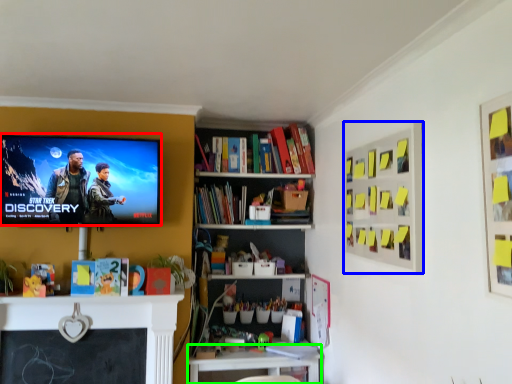
Question: Which object is positioned closest to television (highlighted by a red box)? Select from bulletin board (highlighted by a blue box) and table (highlighted by a green box).

Choices:
 (A) bulletin board
 (B) table

Answer: (B)